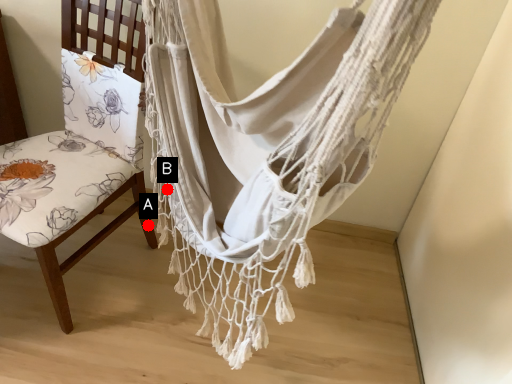
Question: Two points are circled on the image, labeled by A and B beside each circle. Which point appears closest to the camera in this image?

Choices:
 (A) A is closer
 (B) B is closer

Answer: (B)